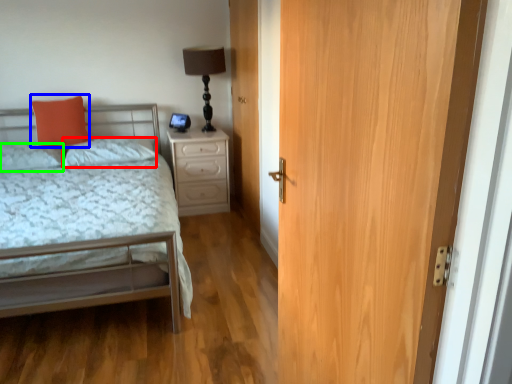
Question: Which is nearer to the pillow (highlighted by a red box)? pillow (highlighted by a blue box) or pillow (highlighted by a green box).

Choices:
 (A) pillow
 (B) pillow

Answer: (A)